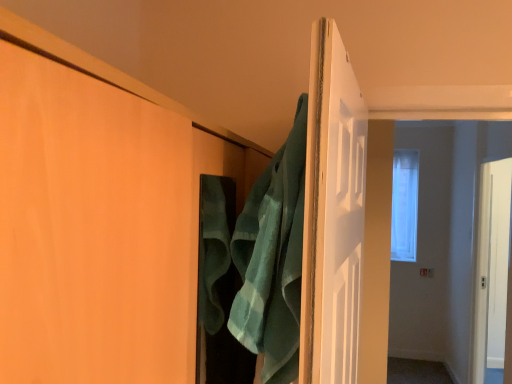
The height and width of the screenshot is (384, 512). What are the coordinates of `green terry cloth bath towel at center` in the screenshot? It's located at (273, 259).

Which of these two, clear glass window at center or matte wood door at center, is thinner?

clear glass window at center.

Could matte wood door at center be considered to be inside clear glass window at center?

No, matte wood door at center is not a part of clear glass window at center.

Is clear glass window at center placed right next to matte wood door at center?

clear glass window at center and matte wood door at center are not in contact.

From a real-world perspective, which object rests below the other?

In real-world perspective, matte wood door at center is lower.

Considering the points (127, 125) and (392, 189), which point is in front, point (127, 125) or point (392, 189)?

The point (127, 125) is closer to the camera.

Find the location of a particular element. door to the left of clear glass window at center is located at coordinates (93, 230).

Which object is positioned more to the left, matte wood door at center or clear glass window at center?

matte wood door at center.

From their relative heights in the image, would you say matte wood door at center is taller or shorter than clear glass window at center?

matte wood door at center is shorter than clear glass window at center.

From the picture: Is green terry cloth bath towel at center next to clear glass window at center and touching it?

No, green terry cloth bath towel at center is not beside clear glass window at center.

How many degrees apart are the facing directions of green terry cloth bath towel at center and clear glass window at center?

The angle between the facing direction of green terry cloth bath towel at center and the facing direction of clear glass window at center is 82.6 degrees.

Considering the relative sizes of green terry cloth bath towel at center and clear glass window at center in the image provided, is green terry cloth bath towel at center smaller than clear glass window at center?

Indeed, green terry cloth bath towel at center has a smaller size compared to clear glass window at center.

Considering the positions of objects green terry cloth bath towel at center and clear glass window at center in the image provided, who is behind, green terry cloth bath towel at center or clear glass window at center?

clear glass window at center.

Considering the positions of objects green terry cloth bath towel at center and matte wood door at center in the image provided, who is more to the right, green terry cloth bath towel at center or matte wood door at center?

Positioned to the right is green terry cloth bath towel at center.

From the image's perspective, is green terry cloth bath towel at center positioned above or below matte wood door at center?

green terry cloth bath towel at center is above matte wood door at center.

In the scene shown: Can you confirm if green terry cloth bath towel at center is wider than matte wood door at center?

No.

Who is shorter, green terry cloth bath towel at center or matte wood door at center?

green terry cloth bath towel at center.

Could green terry cloth bath towel at center be considered to be inside clear glass window at center?

That's incorrect, green terry cloth bath towel at center is not inside clear glass window at center.

Does clear glass window at center appear on the right side of green terry cloth bath towel at center?

Yes, clear glass window at center is to the right of green terry cloth bath towel at center.

From a real-world perspective, is clear glass window at center beneath green terry cloth bath towel at center?

Actually, clear glass window at center is physically above green terry cloth bath towel at center in the real world.

In the scene shown: Can you confirm if clear glass window at center is taller than green terry cloth bath towel at center?

Correct, clear glass window at center is much taller as green terry cloth bath towel at center.

Where is `door in front of the green terry cloth bath towel at center`? door in front of the green terry cloth bath towel at center is located at coordinates (93, 230).

Considering the points (187, 340) and (254, 218), which point is in front, point (187, 340) or point (254, 218)?

The point (187, 340) is closer to the camera.

Could you tell me if matte wood door at center is turned towards green terry cloth bath towel at center?

Yes, matte wood door at center is facing green terry cloth bath towel at center.

Based on the photo, does matte wood door at center have a greater height compared to green terry cloth bath towel at center?

Correct, matte wood door at center is much taller as green terry cloth bath towel at center.

The height and width of the screenshot is (384, 512). Identify the location of window behind the matte wood door at center. (404, 205).

Find the location of a particular element. The height and width of the screenshot is (384, 512). door below the clear glass window at center (from the image's perspective) is located at coordinates (93, 230).

Considering their positions, is matte wood door at center positioned closer to clear glass window at center than green terry cloth bath towel at center?

green terry cloth bath towel at center is positioned closer to the anchor clear glass window at center.

Which object lies nearer to the anchor point matte wood door at center, green terry cloth bath towel at center or clear glass window at center?

Among the two, green terry cloth bath towel at center is located nearer to matte wood door at center.

When comparing their distances from matte wood door at center, does clear glass window at center or green terry cloth bath towel at center seem further?

Based on the image, clear glass window at center appears to be further to matte wood door at center.

When comparing their distances from green terry cloth bath towel at center, does matte wood door at center or clear glass window at center seem further?

clear glass window at center is positioned further to the anchor green terry cloth bath towel at center.

Looking at the image, which one is located further to green terry cloth bath towel at center, clear glass window at center or matte wood door at center?

clear glass window at center is further to green terry cloth bath towel at center.

Which object lies further to the anchor point clear glass window at center, green terry cloth bath towel at center or matte wood door at center?

matte wood door at center.

Identify the location of bath towel between matte wood door at center and clear glass window at center along the z-axis. The image size is (512, 384). (273, 259).